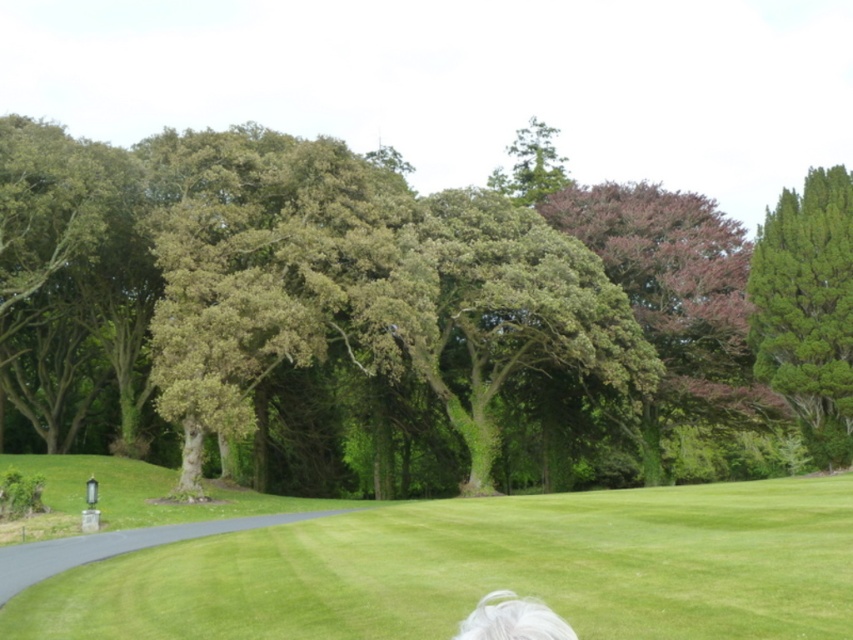
Between green grass at center and gray asphalt path at lower left, which one is positioned lower?

Positioned lower is gray asphalt path at lower left.

The image size is (853, 640). Find the location of `green grass at center`. green grass at center is located at coordinates (486, 570).

The height and width of the screenshot is (640, 853). What do you see at coordinates (486, 570) in the screenshot? I see `green grass at center` at bounding box center [486, 570].

The image size is (853, 640). Find the location of `green grass at center`. green grass at center is located at coordinates (486, 570).

Is green leafy tree at center to the left of green coniferous tree at right from the viewer's perspective?

Yes, green leafy tree at center is to the left of green coniferous tree at right.

Measure the distance between point [585,339] and camera.

Point [585,339] is 116.42 feet from camera.

This screenshot has width=853, height=640. In order to click on green leafy tree at center in this screenshot , I will do `click(410, 316)`.

Where is `green grass at center`? The image size is (853, 640). green grass at center is located at coordinates (486, 570).

Consider the image. Is green grass at center to the right of green coniferous tree at right from the viewer's perspective?

In fact, green grass at center is to the left of green coniferous tree at right.

Between point (790, 636) and point (808, 186), which one is positioned behind?

Point (808, 186)

The height and width of the screenshot is (640, 853). What are the coordinates of `green grass at center` in the screenshot? It's located at (486, 570).